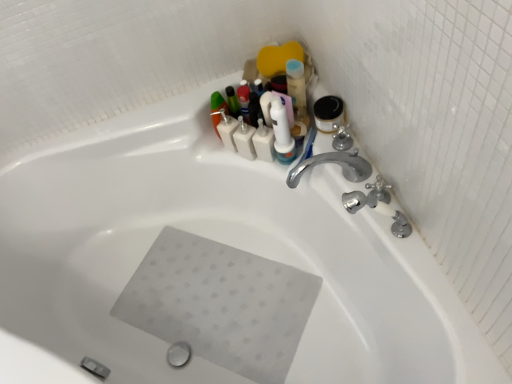
Locate an element on the screen. This screenshot has width=512, height=384. free space to the back side of satin nickel faucet at upper right, the 1th plumbing fixture when ordered from back to front is located at coordinates (359, 168).